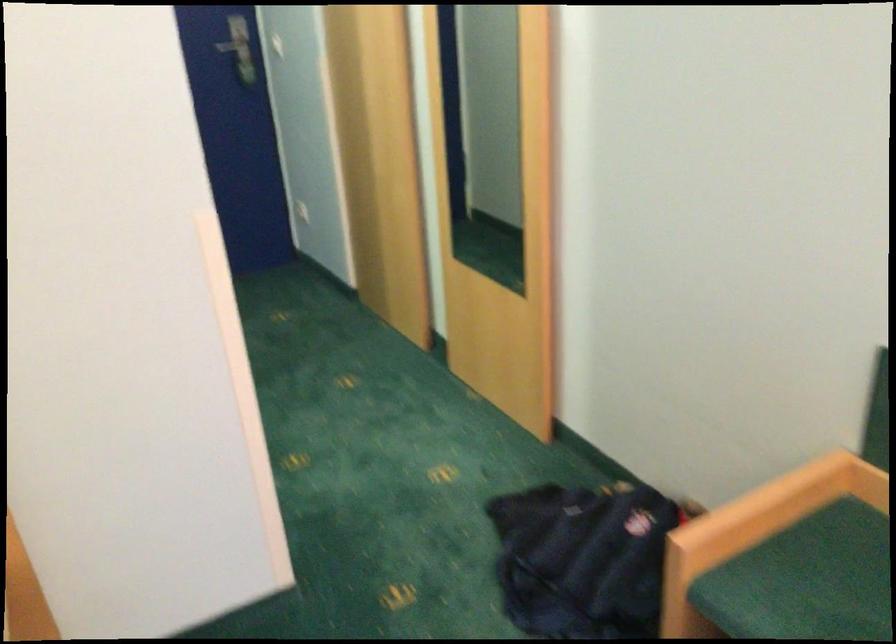
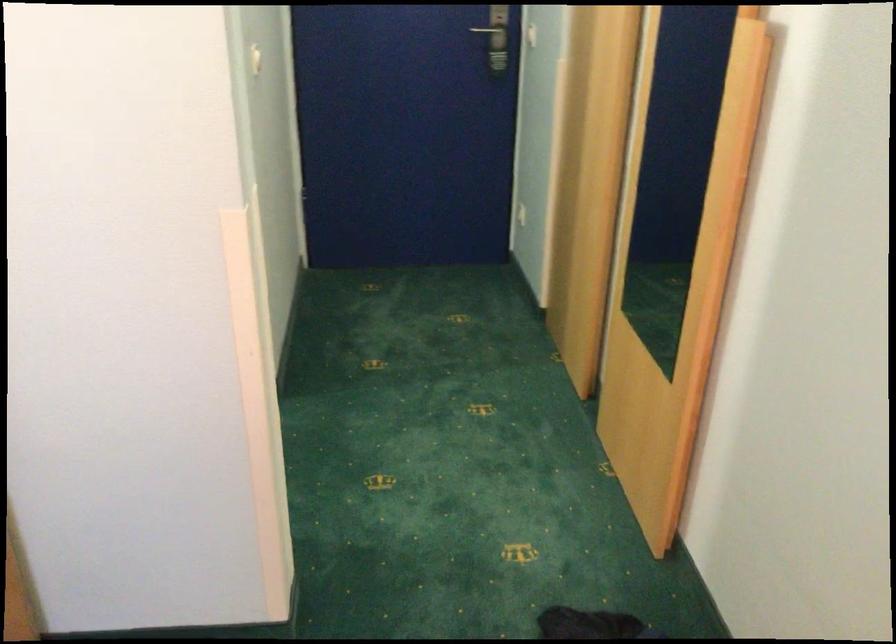
Which direction would the cameraman need to move to produce the second image?

The cameraman moved toward right, forward.